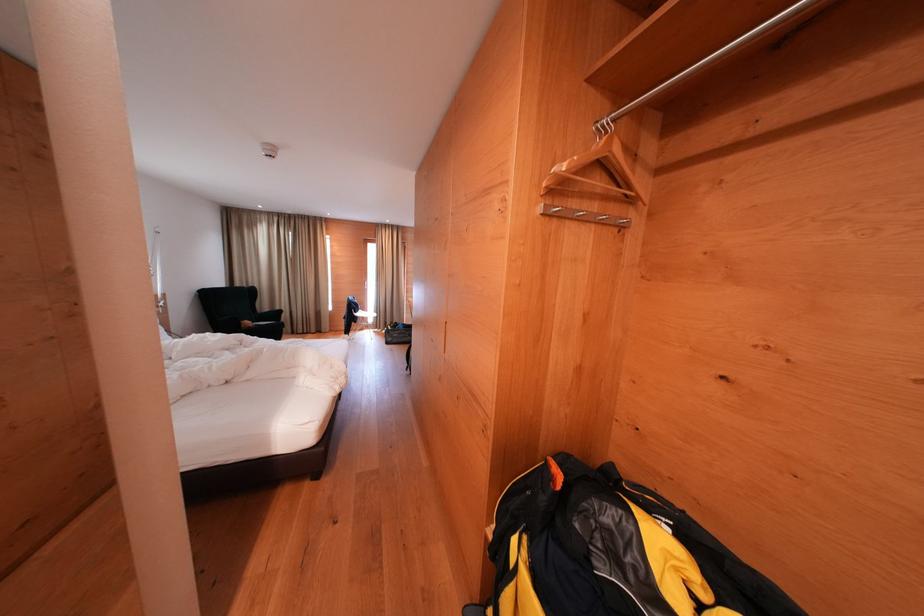
What do you see at coordinates (584, 216) in the screenshot? Image resolution: width=924 pixels, height=616 pixels. I see `a metal coat hook` at bounding box center [584, 216].